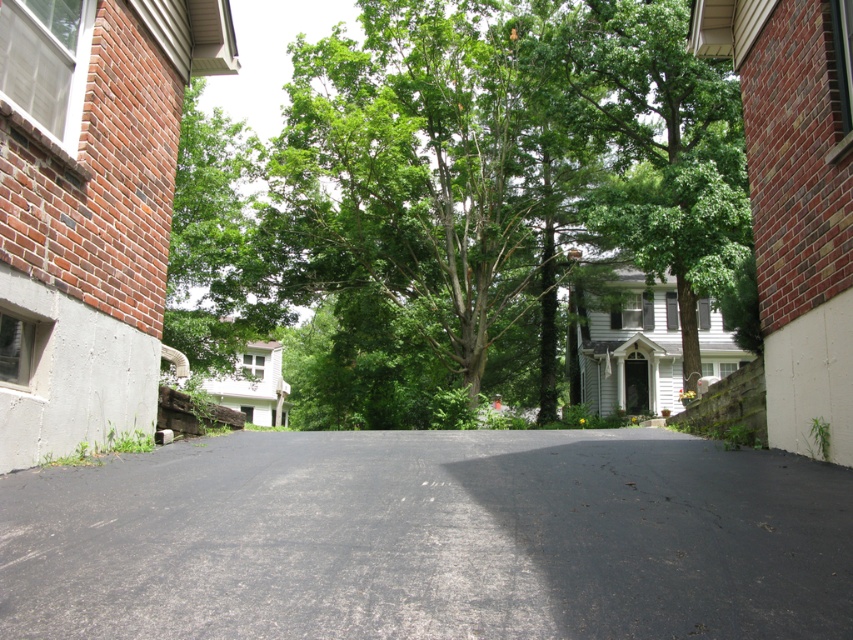
Between green leafy tree at center and black asphalt driveway at center, which one has more height?

With more height is green leafy tree at center.

Does point (421, 406) come in front of point (770, 577)?

No, (421, 406) is behind (770, 577).

The height and width of the screenshot is (640, 853). What do you see at coordinates (474, 180) in the screenshot? I see `green leafy tree at center` at bounding box center [474, 180].

Image resolution: width=853 pixels, height=640 pixels. Find the location of `green leafy tree at center`. green leafy tree at center is located at coordinates (474, 180).